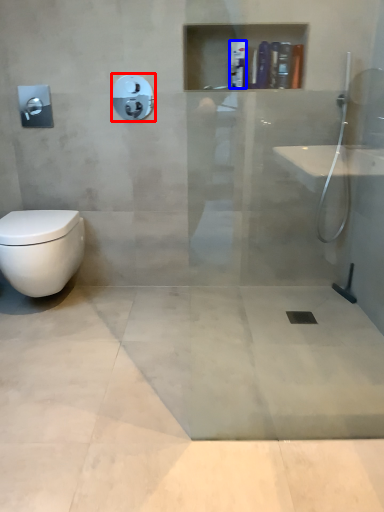
Question: Which object is further to the camera taking this photo, shower (highlighted by a red box) or toiletry (highlighted by a blue box)?

Choices:
 (A) shower
 (B) toiletry

Answer: (B)